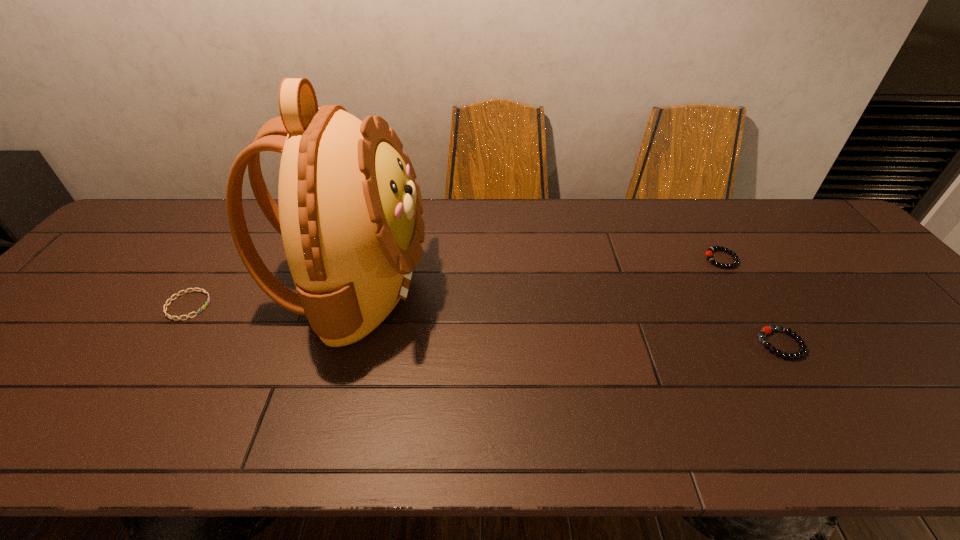
In order to click on object at the far edge in this screenshot , I will do `click(349, 213)`.

This screenshot has height=540, width=960. In order to click on free space at the far edge of the desktop in this screenshot , I will do `click(650, 245)`.

Locate an element on the screen. vacant space at the near edge of the desktop is located at coordinates (412, 436).

In the image, there is a desktop. Where is `vacant space at the left edge`? This screenshot has height=540, width=960. vacant space at the left edge is located at coordinates (13, 386).

At what (x,y) coordinates should I click in order to perform the action: click on vacant space at the right edge of the desktop. Please return your answer as a coordinate pair (x, y). This screenshot has height=540, width=960. Looking at the image, I should click on (881, 298).

This screenshot has width=960, height=540. I want to click on vacant space at the far left corner of the desktop, so click(x=181, y=209).

At what (x,y) coordinates should I click in order to perform the action: click on unoccupied area between the nearest bracelet and the leftmost bracelet. Please return your answer as a coordinate pair (x, y). The height and width of the screenshot is (540, 960). Looking at the image, I should click on (485, 325).

Locate an element on the screen. The image size is (960, 540). empty location between the tallest object and the farthest bracelet is located at coordinates (538, 273).

At what (x,y) coordinates should I click in order to perform the action: click on free space between the backpack and the nearest bracelet. Please return your answer as a coordinate pair (x, y). Looking at the image, I should click on (567, 315).

The image size is (960, 540). In order to click on empty space that is in between the second farthest bracelet and the nearest bracelet in this screenshot , I will do `click(485, 325)`.